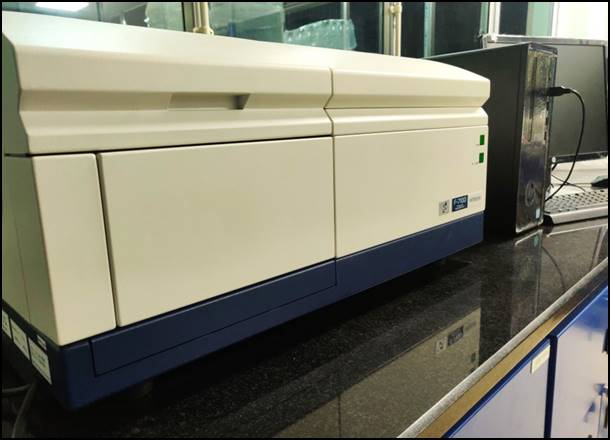
Locate an element on the screen. The image size is (610, 440). cabinet lable is located at coordinates (542, 356).